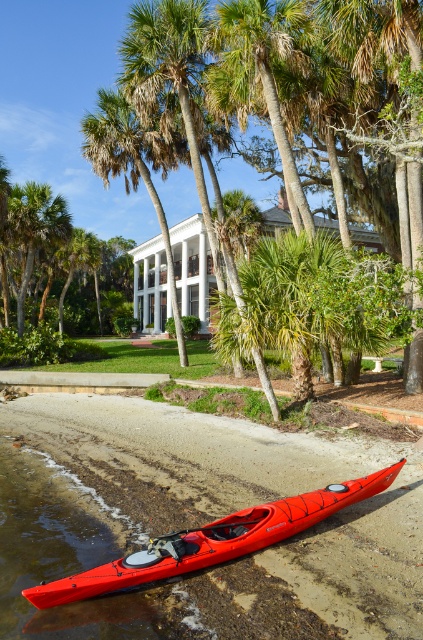
Question: Which point appears closest to the camera in this image?

Choices:
 (A) (159, 211)
 (B) (148, 573)
 (C) (49, 224)

Answer: (B)

Question: Which object is the farthest from the green leafy palm tree at left?

Choices:
 (A) green leafy palm tree at center
 (B) shiny red kayak at lower left

Answer: (B)

Question: Can you confirm if shiny red kayak at lower left is positioned above green leafy palm tree at center?

Choices:
 (A) no
 (B) yes

Answer: (A)

Question: Is shiny red kayak at lower left to the right of green leafy palm tree at center from the viewer's perspective?

Choices:
 (A) yes
 (B) no

Answer: (A)

Question: Which point is farther to the camera?

Choices:
 (A) green leafy palm tree at left
 (B) green leafy palm tree at center
 (C) shiny red kayak at lower left

Answer: (A)

Question: Is shiny red kayak at lower left bigger than green leafy palm tree at center?

Choices:
 (A) no
 (B) yes

Answer: (A)